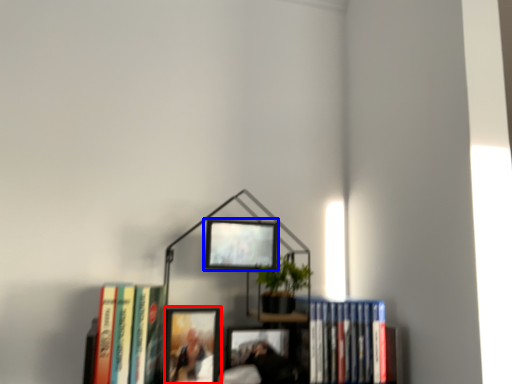
Question: Among these objects, which one is farthest to the camera, picture frame (highlighted by a red box) or picture frame (highlighted by a blue box)?

Choices:
 (A) picture frame
 (B) picture frame

Answer: (B)